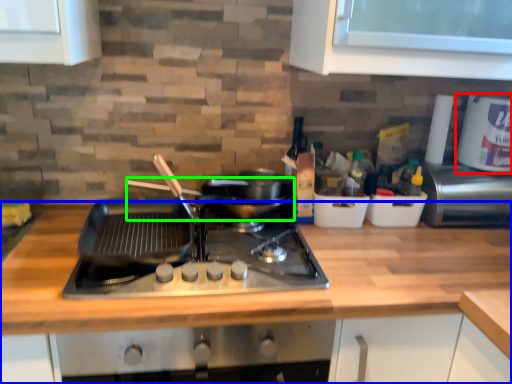
Question: Based on their relative distances, which object is nearer to kitchen appliance (highlighted by a red box)? Choose from countertop (highlighted by a blue box) and wok (highlighted by a green box).

Choices:
 (A) countertop
 (B) wok

Answer: (A)